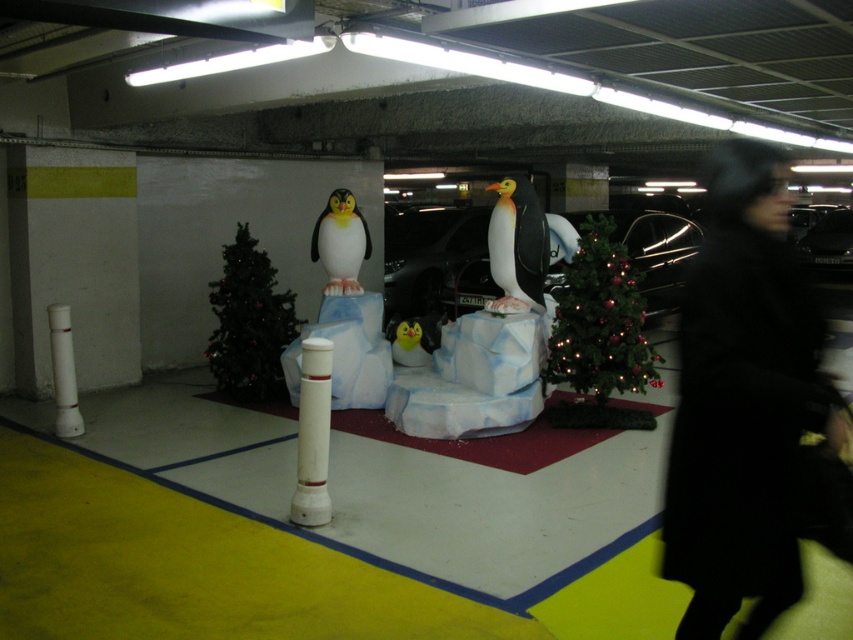
Consider the image. You are a visitor entering the parking garage and notice the glossy black car at center and the white plastic pole at left. Which object is positioned higher from the ground?

The glossy black car at center is located above the white plastic pole at left, so it is positioned higher from the ground.

You are a parking attendant who needs to place a new decorative item on the glossy black car at center. However, there is a white plastic pole at center in the way. Can you place the item directly on top of the car without moving the pole?

The glossy black car at center is above the white plastic pole at center, so the pole is already positioned under the car. This means you can safely place the decorative item on top of the car without needing to move the pole.

You are standing in the parking garage and want to take a photo of both the penguin display and the festive decorations. You notice two points marked in the scene at coordinates point (416, 285) and point (320, 474). Which point should you stand closer to in order to ensure both the penguin display and the decorations are in frame?

You should stand closer to point (320, 474) because point (416, 285) is further away from the camera, so positioning yourself near the closer point will help keep both elements in the frame.